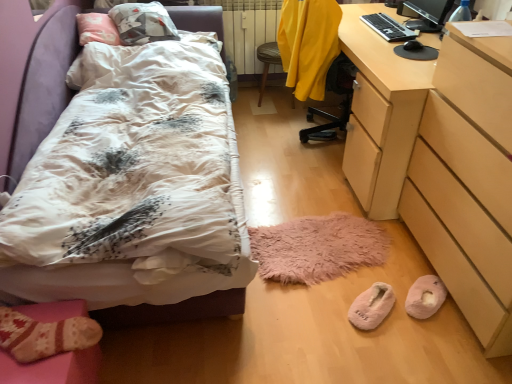
In order to click on blank area beneath black glossy monitor at upper right (from a real-world perspective) in this screenshot , I will do `click(423, 23)`.